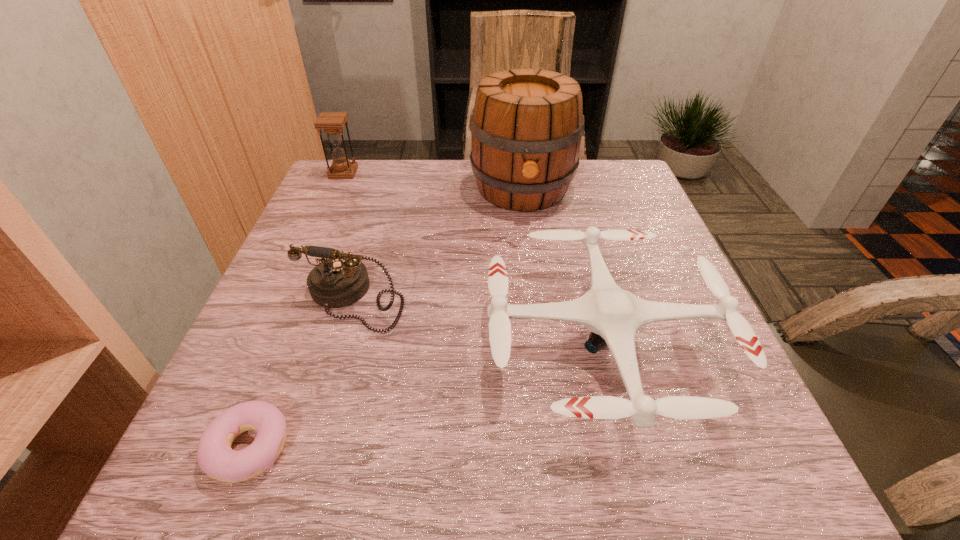
This screenshot has height=540, width=960. I want to click on cider, so click(x=526, y=127).

At what (x,y) coordinates should I click in order to perform the action: click on hourglass. Please return your answer as a coordinate pair (x, y). Looking at the image, I should click on (332, 122).

The height and width of the screenshot is (540, 960). I want to click on telephone, so click(x=340, y=279).

Where is `drone`? The height and width of the screenshot is (540, 960). drone is located at coordinates click(x=614, y=315).

This screenshot has height=540, width=960. Identify the location of the shortest object. (215, 457).

Identify the location of free spot located 0.140m on the side of the tallest object where the spigot is located. (532, 260).

The height and width of the screenshot is (540, 960). I want to click on free space located on the right of the fourth shortest object, so click(x=420, y=173).

Where is `vacant space situated on the front of the telephone`? Image resolution: width=960 pixels, height=540 pixels. vacant space situated on the front of the telephone is located at coordinates (303, 465).

The width and height of the screenshot is (960, 540). I want to click on free space located on the back of the shortest object, so click(x=282, y=364).

Find the location of a particular element. cider that is at the far edge is located at coordinates (526, 127).